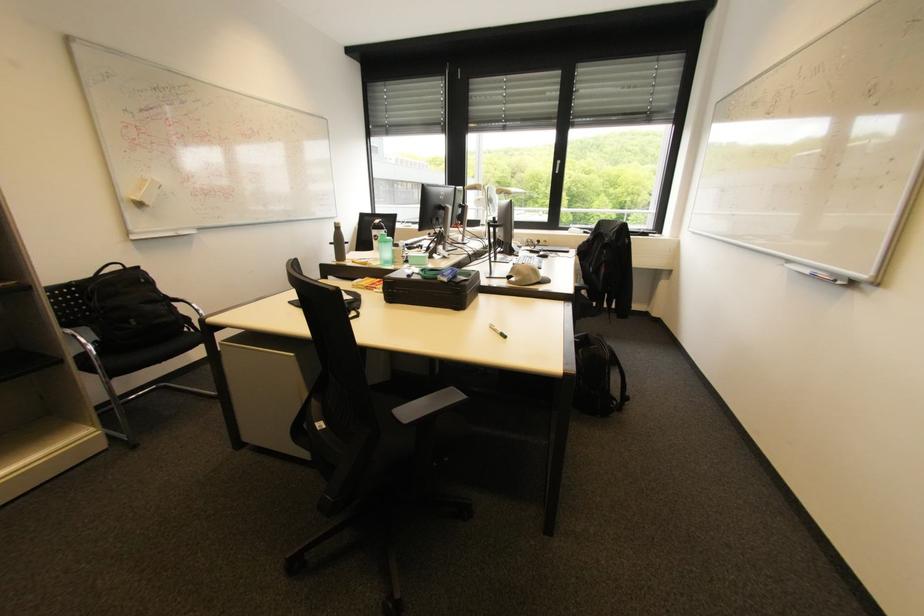
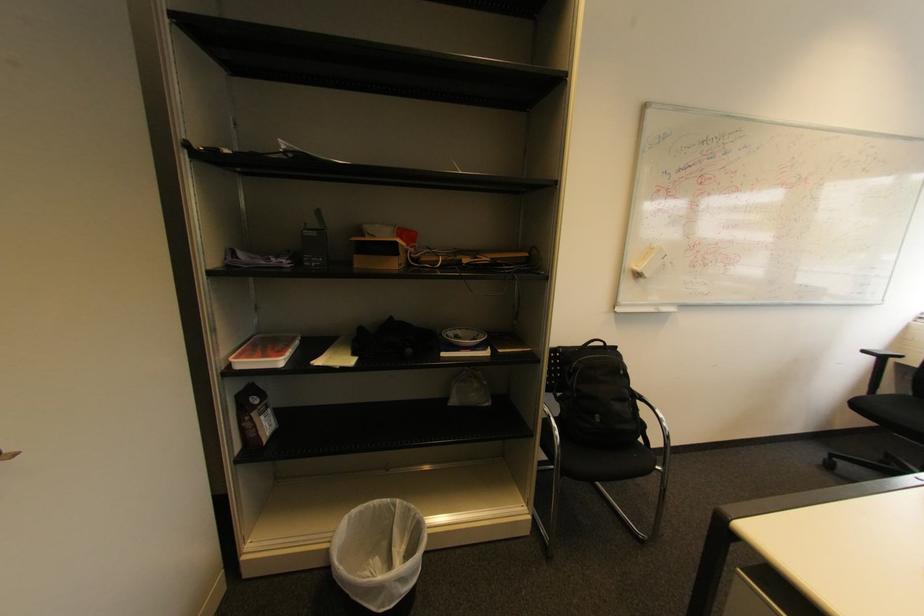
Locate, in the second image, the point that corresponds to the point at 335,244 in the first image.

(869, 352)